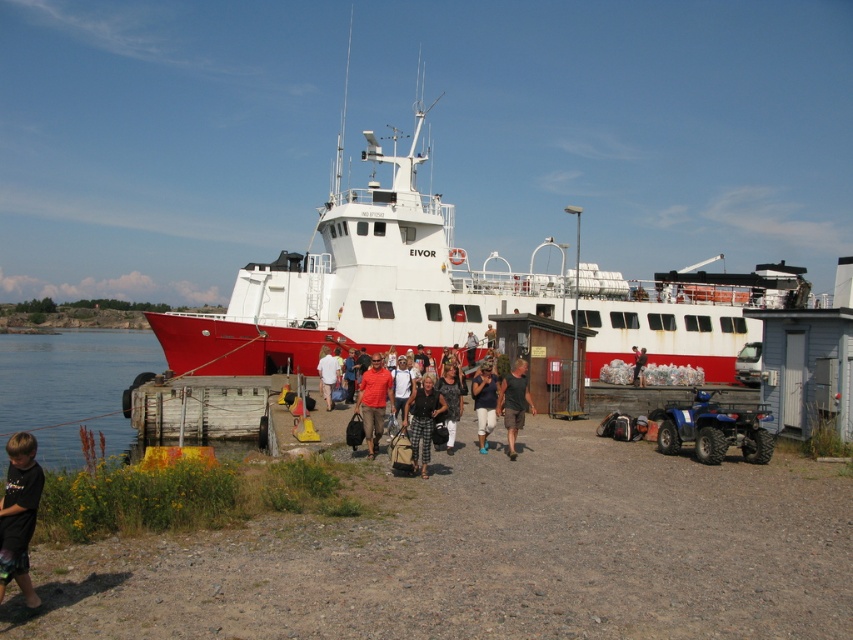
Consider the image. You are standing at the dock and want to reach the ferry EIVOR. There are two points marked on the dock, point A at coordinates point [780,298] and point B at coordinates point [247,426]. Which point is closer to the ferry?

Point A at coordinates point [780,298] is closer to the ferry because it is further to the viewer than point B at coordinates point [247,426].

You are a photographer standing at the dock. You see a passenger wearing a matte orange shirt at center and another wearing a white cotton shirt at center. Which shirt is positioned higher in the image?

The matte orange shirt at center is located above the white cotton shirt at center, so it is positioned higher in the image.